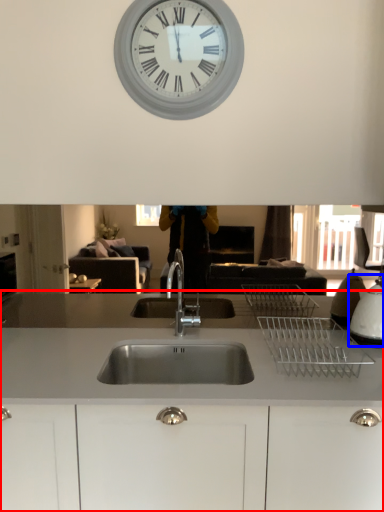
Question: Which of the following is the closest to the observer, countertop (highlighted by a red box) or appliance (highlighted by a blue box)?

Choices:
 (A) countertop
 (B) appliance

Answer: (A)